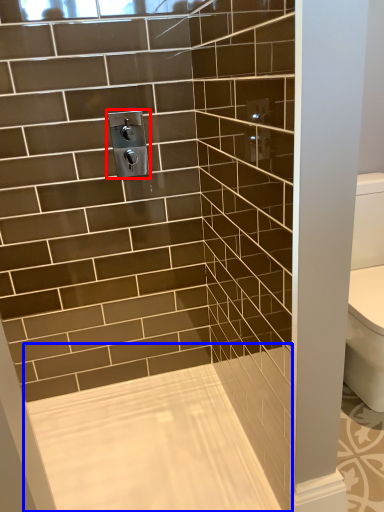
Question: Which of the following is the farthest to the observer, plumbing fixture (highlighted by a red box) or bath (highlighted by a blue box)?

Choices:
 (A) plumbing fixture
 (B) bath

Answer: (A)